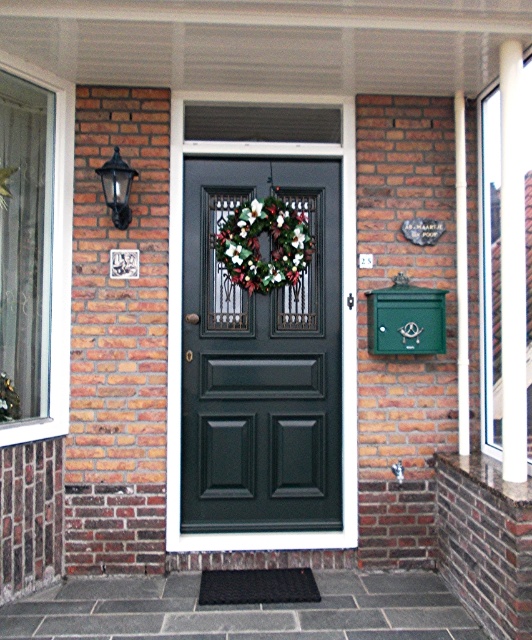
Question: Which object is the farthest from the white smooth pillar at upper right?

Choices:
 (A) matte black door at center
 (B) green floral wreath at center

Answer: (B)

Question: Which object is positioned closest to the green floral wreath at center?

Choices:
 (A) white smooth pillar at upper right
 (B) green painted wood pillar at right
 (C) matte black door at center

Answer: (C)

Question: Is matte black door at center to the right of green painted wood pillar at right from the viewer's perspective?

Choices:
 (A) no
 (B) yes

Answer: (A)

Question: Does matte black door at center appear over green floral wreath at center?

Choices:
 (A) yes
 (B) no

Answer: (B)

Question: Where is matte black door at center located in relation to green painted wood pillar at right in the image?

Choices:
 (A) right
 (B) left

Answer: (B)

Question: Estimate the real-world distances between objects in this image. Which object is farther from the white smooth pillar at upper right?

Choices:
 (A) green floral wreath at center
 (B) green painted wood pillar at right
 (C) matte black door at center

Answer: (A)